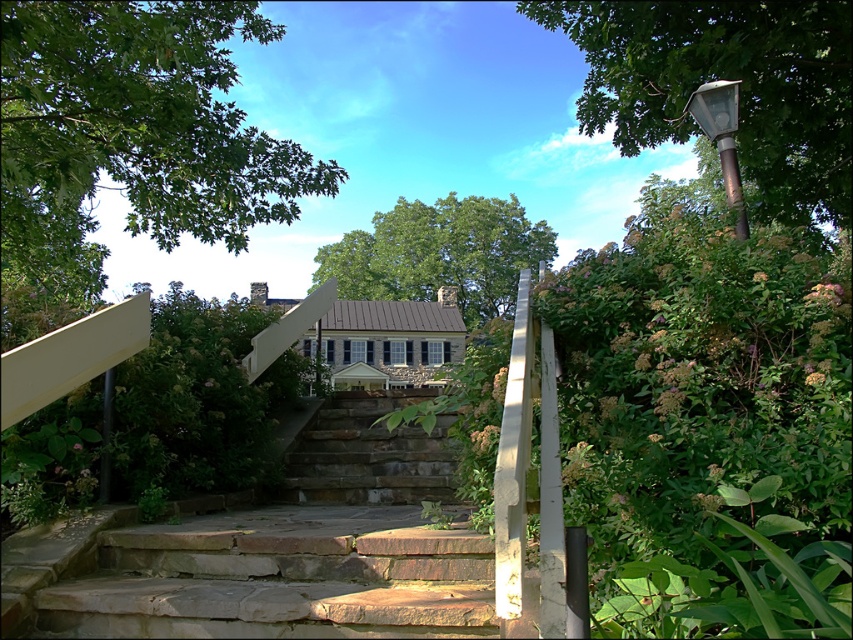
You are standing at the bottom of the natural stone stairs at center and want to reach the house. Which direction should you look to see the green leafy tree at upper left?

The green leafy tree at upper left is positioned over the natural stone stairs at center, so you should look upward to see it.

You are standing at the bottom of the natural stone stairs at center and want to walk up to the house. However, there is a green leafy tree at center blocking your view. Which direction should you move to get a clear path to the stairs?

The natural stone stairs at center is behind the green leafy tree at center, so you should move to the side of the tree to get a clear path to the stairs.